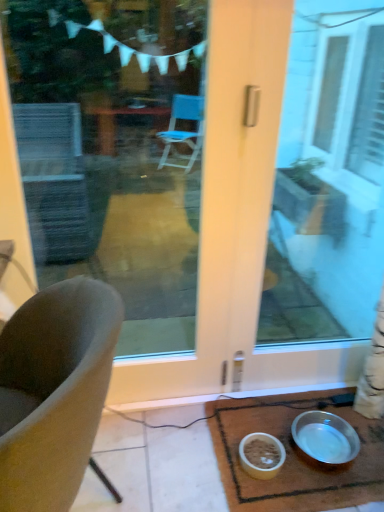
Question: From the image's perspective, is metallic silver bowl at lower right over transparent glass door at center, positioned as the 2th window screen in right-to-left order?

Choices:
 (A) no
 (B) yes

Answer: (A)

Question: Is metallic silver bowl at lower right to the left of transparent glass door at center, positioned as the 2th window screen in right-to-left order, from the viewer's perspective?

Choices:
 (A) no
 (B) yes

Answer: (A)

Question: Is metallic silver bowl at lower right to the right of transparent glass door at center, positioned as the 2th window screen in right-to-left order, from the viewer's perspective?

Choices:
 (A) no
 (B) yes

Answer: (B)

Question: Is metallic silver bowl at lower right outside of transparent glass door at center, positioned as the 2th window screen in right-to-left order?

Choices:
 (A) no
 (B) yes

Answer: (B)

Question: From a real-world perspective, is metallic silver bowl at lower right physically below transparent glass door at center, the first window screen positioned from the left?

Choices:
 (A) no
 (B) yes

Answer: (B)

Question: Considering their positions, is transparent glass door at center, placed as the second window screen when sorted from left to right, located in front of or behind metallic silver bowl at lower right?

Choices:
 (A) behind
 (B) front

Answer: (B)

Question: From a real-world perspective, relative to metallic silver bowl at lower right, is transparent glass door at center, placed as the second window screen when sorted from left to right, vertically above or below?

Choices:
 (A) below
 (B) above

Answer: (B)

Question: Is point (329, 136) positioned closer to the camera than point (289, 422)?

Choices:
 (A) farther
 (B) closer

Answer: (A)

Question: In terms of size, does transparent glass door at center, placed as the second window screen when sorted from left to right, appear bigger or smaller than metallic silver bowl at lower right?

Choices:
 (A) small
 (B) big

Answer: (B)

Question: From a real-world perspective, is silver metallic bowl at lower right, arranged as the 1th bowl when viewed from the right, physically located above or below transparent glass door at center, placed as the second window screen when sorted from left to right?

Choices:
 (A) below
 (B) above

Answer: (A)

Question: Is point (329, 417) closer or farther from the camera than point (357, 307)?

Choices:
 (A) closer
 (B) farther

Answer: (A)

Question: Is silver metallic bowl at lower right, arranged as the 1th bowl when viewed from the right, in front of or behind transparent glass door at center, which is the 1th window screen in right-to-left order, in the image?

Choices:
 (A) front
 (B) behind

Answer: (B)

Question: In the image, is silver metallic bowl at lower right, arranged as the 1th bowl when viewed from the right, on the left side or the right side of transparent glass door at center, which is the 1th window screen in right-to-left order?

Choices:
 (A) right
 (B) left

Answer: (B)

Question: Considering the positions of transparent glass door at center, the first window screen positioned from the left, and silver metallic bowl at lower right, arranged as the 1th bowl when viewed from the right, in the image, is transparent glass door at center, the first window screen positioned from the left, taller or shorter than silver metallic bowl at lower right, arranged as the 1th bowl when viewed from the right,?

Choices:
 (A) short
 (B) tall

Answer: (B)

Question: From the image's perspective, relative to silver metallic bowl at lower right, the 2th bowl in the left-to-right sequence, is transparent glass door at center, the first window screen positioned from the left, above or below?

Choices:
 (A) below
 (B) above

Answer: (B)